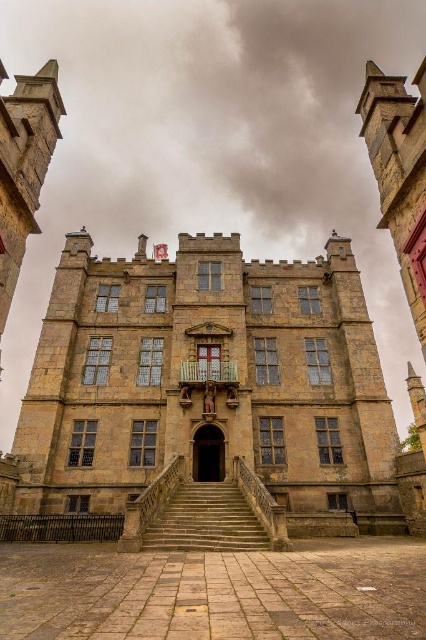
Does stone castle at center have a smaller size compared to stone textured stairs at center?

Incorrect, stone castle at center is not smaller in size than stone textured stairs at center.

Does point (89, 461) come farther from viewer compared to point (181, 484)?

Yes, it is behind point (181, 484).

This screenshot has height=640, width=426. In order to click on stone castle at center in this screenshot , I will do `click(210, 381)`.

Is stone castle at center to the right of brown stone archway at center from the viewer's perspective?

Yes, stone castle at center is to the right of brown stone archway at center.

Is point (376, 483) closer to viewer compared to point (207, 442)?

Yes.

Locate an element on the screen. The height and width of the screenshot is (640, 426). stone castle at center is located at coordinates (210, 381).

Which is behind, point (226, 500) or point (213, 436)?

The point (213, 436) is more distant.

Is point (252, 547) closer to camera compared to point (213, 454)?

Yes, it is.

The width and height of the screenshot is (426, 640). Find the location of `stone textured stairs at center`. stone textured stairs at center is located at coordinates (206, 520).